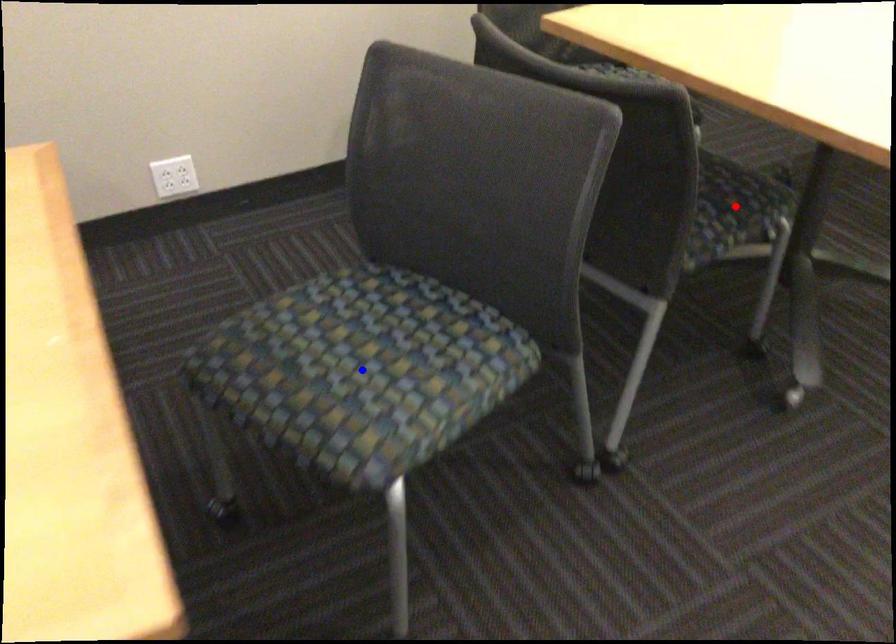
Question: Which of the two points in the image is closer to the camera?

Choices:
 (A) Blue point is closer.
 (B) Red point is closer.

Answer: (A)